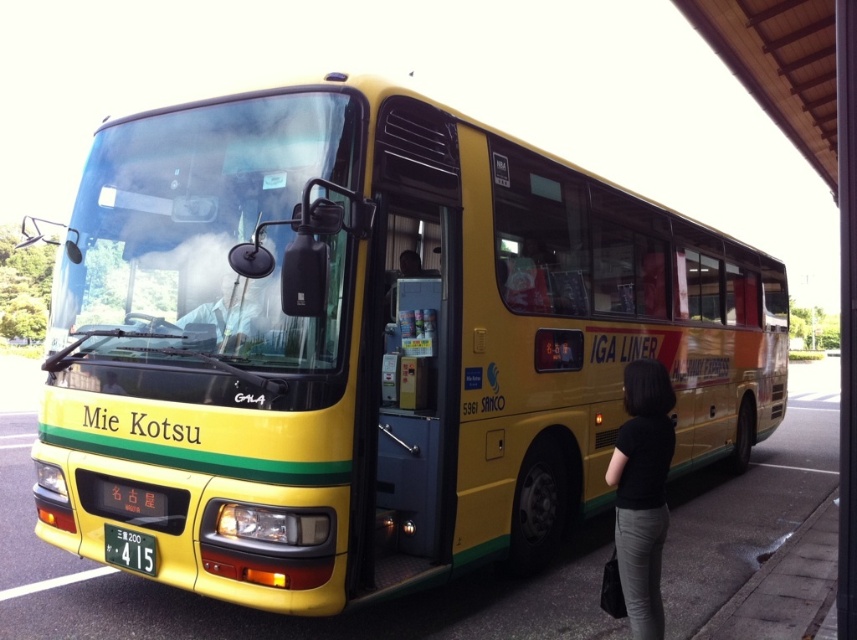
Is black fabric at lower right to the left of yellow plastic license plate at lower center from the viewer's perspective?

In fact, black fabric at lower right is to the right of yellow plastic license plate at lower center.

Can you confirm if black fabric at lower right is wider than yellow plastic license plate at lower center?

No.

Locate an element on the screen. black fabric at lower right is located at coordinates (642, 492).

I want to click on black fabric at lower right, so click(x=642, y=492).